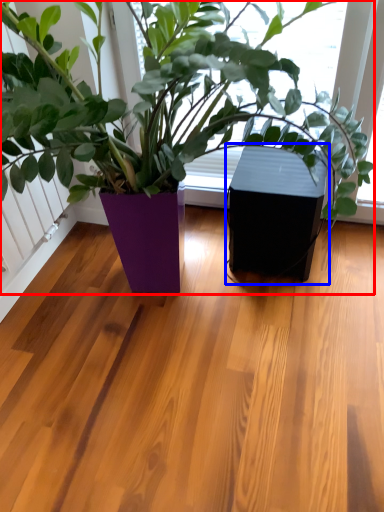
Question: Which of the following is the closest to the observer, houseplant (highlighted by a red box) or window box (highlighted by a blue box)?

Choices:
 (A) houseplant
 (B) window box

Answer: (A)